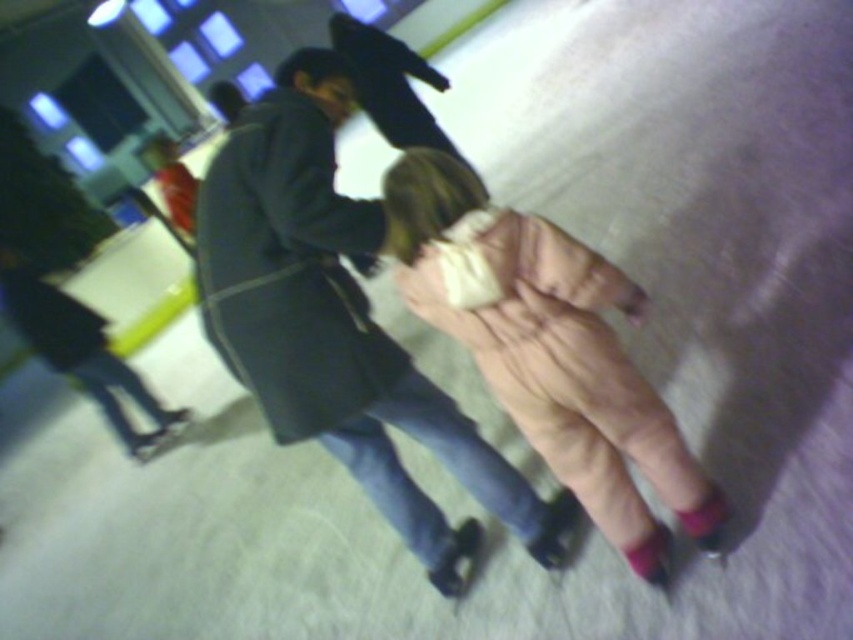
You are standing at the edge of the ice rink and see two points marked on the ice surface. The first point is at coordinates point (x=231, y=244) and the second is at point (x=442, y=330). Which point is closer to you?

Point (x=231, y=244) is closer to the camera than point 0.519, so you should aim for point (x=231, y=244) first as it is nearer to your current position at the edge of the rink.

You are an ice skating instructor. You need to check the distance between the dark gray coat at center and the child in the scene. Is the distance within the recommended safety range of 5 feet for close supervision?

The distance between the dark gray coat at center and the child is 5.06 feet, which is slightly beyond the recommended safety range of 5 feet for close supervision.

You are an ice skating instructor observing the scene. You notice the dark gray coat at center and the pink fuzzy coat at center. Which skater is closer to the front of the rink?

The dark gray coat at center is closer to the front of the rink because the pink fuzzy coat at center is behind it.